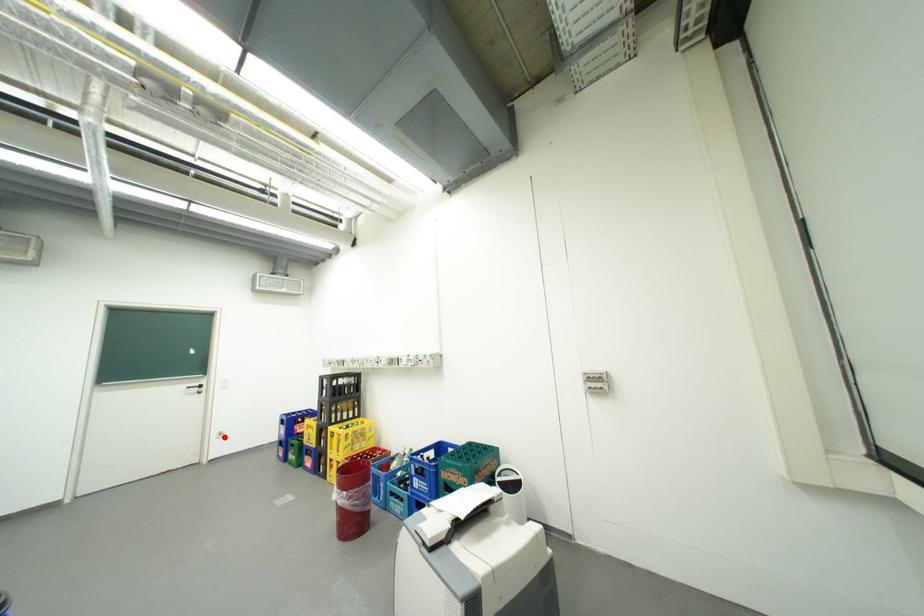
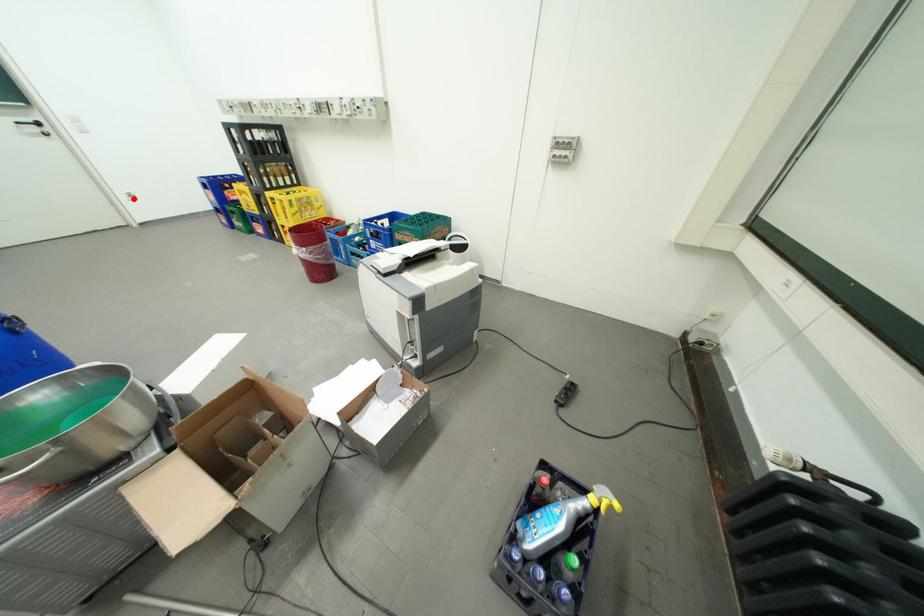
Consider the image. I am providing you with two images of the same scene from different viewpoints. A red point is marked on the first image and another point is marked on the second image. Is the marked point in image1 the same physical position as the marked point in image2?

Yes